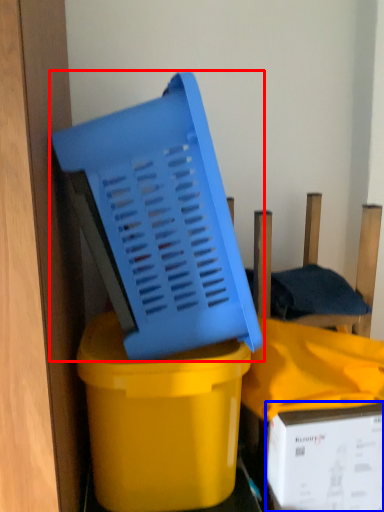
Question: Which of the following is the farthest to the observer, basket (highlighted by a red box) or box (highlighted by a blue box)?

Choices:
 (A) basket
 (B) box

Answer: (B)